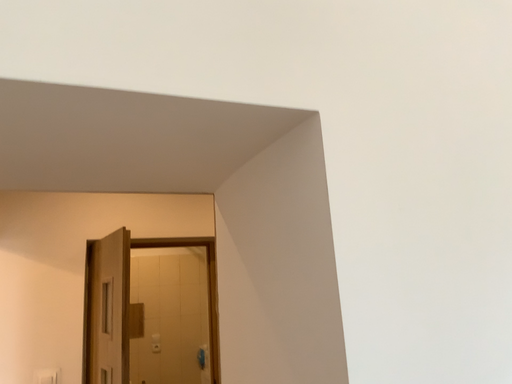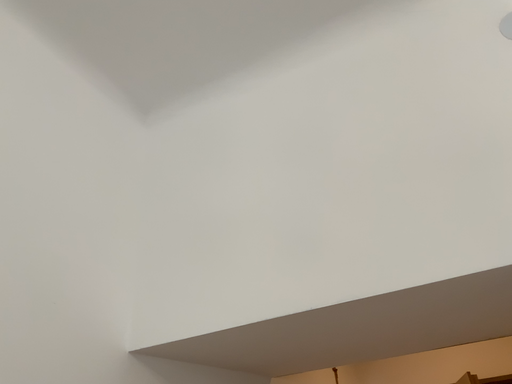
Question: How did the camera likely rotate when shooting the video?

Choices:
 (A) rotated upward
 (B) rotated downward

Answer: (A)